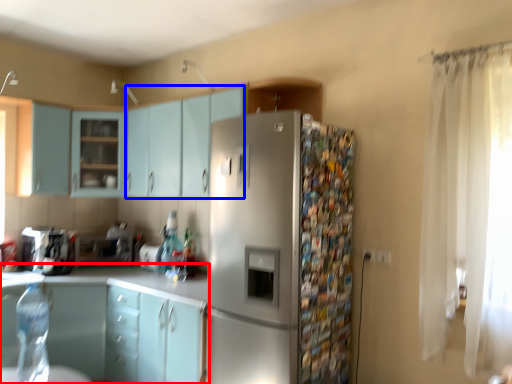
Question: Among these objects, which one is farthest to the camera, cabinetry (highlighted by a red box) or cabinetry (highlighted by a blue box)?

Choices:
 (A) cabinetry
 (B) cabinetry

Answer: (B)